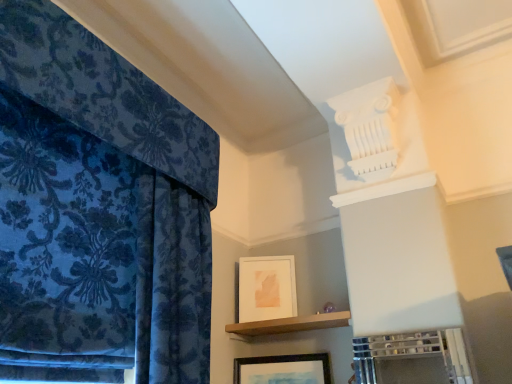
Question: Which direction should I rotate to look at wooden framed picture at lower center, which is counted as the first picture frame, starting from the front, — up or down?

Choices:
 (A) up
 (B) down

Answer: (B)

Question: Is brown wooden shelf at center taller than wooden framed picture at lower center, which is the 2th picture frame in back-to-front order?

Choices:
 (A) no
 (B) yes

Answer: (A)

Question: From the image's perspective, would you say brown wooden shelf at center is shown under wooden framed picture at lower center, the second picture frame in the top-to-bottom sequence?

Choices:
 (A) no
 (B) yes

Answer: (A)

Question: From a real-world perspective, does brown wooden shelf at center stand above wooden framed picture at lower center, positioned as the first picture frame in bottom-to-top order?

Choices:
 (A) yes
 (B) no

Answer: (A)

Question: Can you confirm if brown wooden shelf at center is shorter than wooden framed picture at lower center, which is the 2th picture frame in back-to-front order?

Choices:
 (A) no
 (B) yes

Answer: (B)

Question: Is brown wooden shelf at center closer to camera compared to wooden framed picture at lower center, which is counted as the first picture frame, starting from the front?

Choices:
 (A) yes
 (B) no

Answer: (A)

Question: From a real-world perspective, is brown wooden shelf at center positioned under wooden framed picture at lower center, which is the 2th picture frame in back-to-front order, based on gravity?

Choices:
 (A) yes
 (B) no

Answer: (B)

Question: Considering the relative sizes of white matte picture frame at upper center, the second picture frame ordered from the bottom, and wooden framed picture at lower center, the second picture frame in the top-to-bottom sequence, in the image provided, is white matte picture frame at upper center, the second picture frame ordered from the bottom, thinner than wooden framed picture at lower center, the second picture frame in the top-to-bottom sequence,?

Choices:
 (A) no
 (B) yes

Answer: (B)

Question: Is white matte picture frame at upper center, the 2th picture frame when ordered from front to back, smaller than wooden framed picture at lower center, positioned as the first picture frame in bottom-to-top order?

Choices:
 (A) no
 (B) yes

Answer: (B)

Question: Is white matte picture frame at upper center, the 2th picture frame when ordered from front to back, next to wooden framed picture at lower center, positioned as the first picture frame in bottom-to-top order?

Choices:
 (A) yes
 (B) no

Answer: (B)

Question: From the image's perspective, is white matte picture frame at upper center, the second picture frame ordered from the bottom, below wooden framed picture at lower center, which is the 2th picture frame in back-to-front order?

Choices:
 (A) no
 (B) yes

Answer: (A)

Question: Can you confirm if white matte picture frame at upper center, the 2th picture frame when ordered from front to back, is positioned to the right of wooden framed picture at lower center, positioned as the first picture frame in bottom-to-top order?

Choices:
 (A) yes
 (B) no

Answer: (B)

Question: Considering the relative sizes of white matte picture frame at upper center, acting as the 1th picture frame starting from the top, and wooden framed picture at lower center, the second picture frame in the top-to-bottom sequence, in the image provided, is white matte picture frame at upper center, acting as the 1th picture frame starting from the top, shorter than wooden framed picture at lower center, the second picture frame in the top-to-bottom sequence,?

Choices:
 (A) no
 (B) yes

Answer: (A)

Question: From a real-world perspective, is velvet blue curtain at left positioned under wooden framed picture at lower center, which is counted as the first picture frame, starting from the front, based on gravity?

Choices:
 (A) no
 (B) yes

Answer: (A)